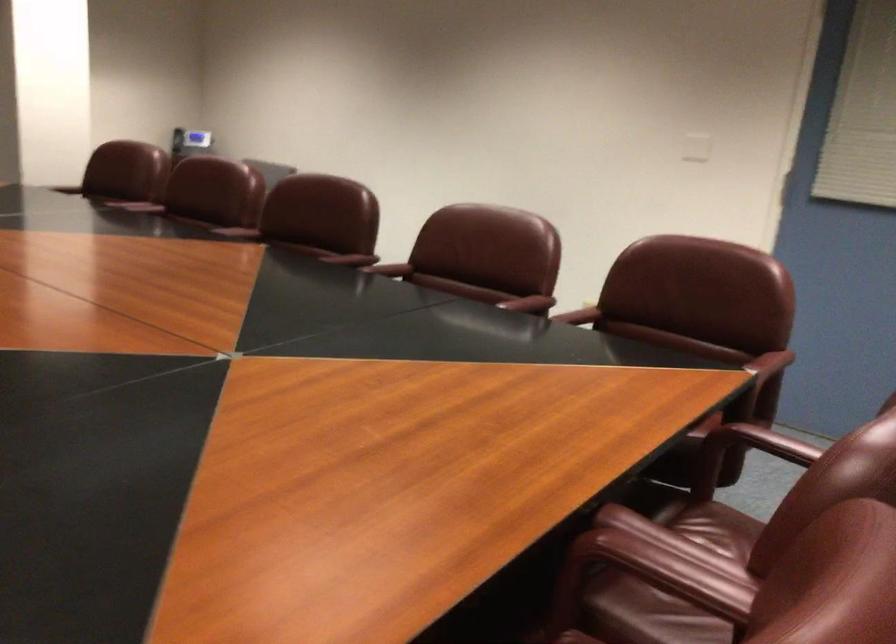
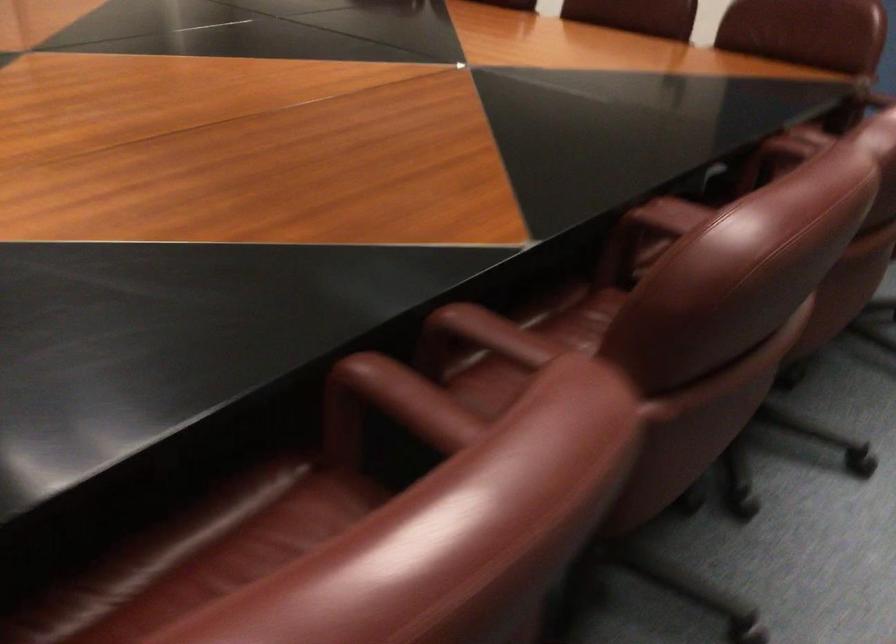
The point at (x=346, y=248) is marked in the first image. Where is the corresponding point in the second image?

(528, 344)